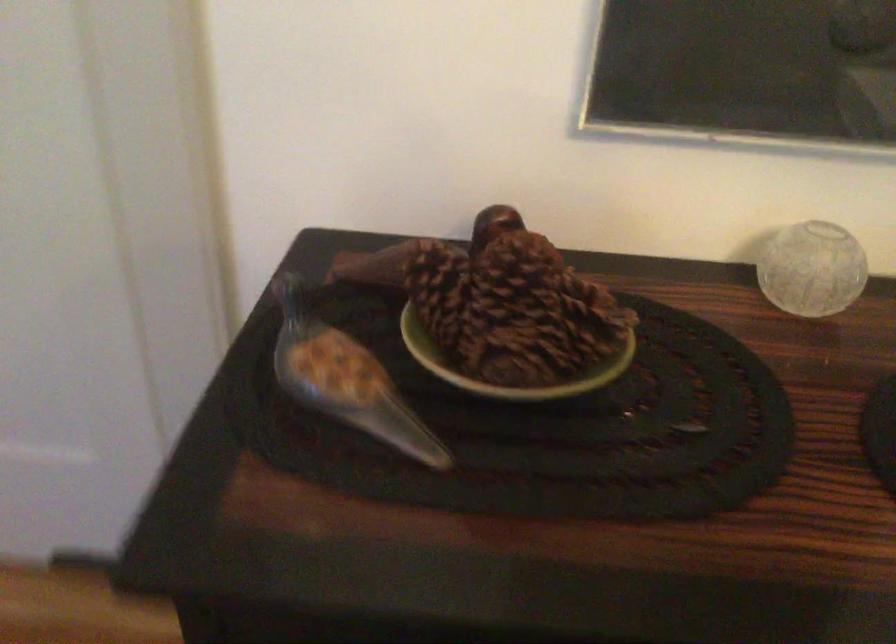
You are a GUI agent. You are given a task and a screenshot of the screen. Output one action in this format:
    pyautogui.click(x=<x>, y=<y>)
    Task: Click on the small green bowl
    
    Given the screenshot: What is the action you would take?
    click(x=506, y=366)